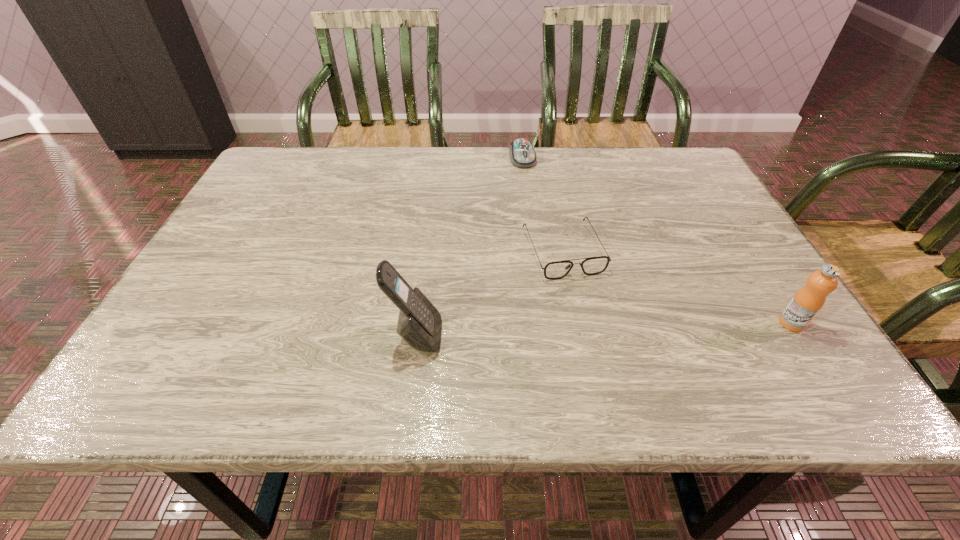
The height and width of the screenshot is (540, 960). Identify the location of vacant area at the near edge. (269, 341).

The height and width of the screenshot is (540, 960). In the image, there is a desktop. What are the coordinates of `vacant space at the left edge` in the screenshot? It's located at (256, 219).

In the image, there is a desktop. Where is `vacant area at the far left corner`? Image resolution: width=960 pixels, height=540 pixels. vacant area at the far left corner is located at coordinates (305, 192).

Locate an element on the screen. vacant space at the far right corner is located at coordinates (661, 156).

Where is `free space at the near right corner of the desktop`? This screenshot has height=540, width=960. free space at the near right corner of the desktop is located at coordinates (797, 334).

Identify the location of free point between the second tallest object and the sunglasses. (677, 287).

This screenshot has width=960, height=540. Find the location of `free space between the leftmost object and the rightmost object`. free space between the leftmost object and the rightmost object is located at coordinates (604, 329).

The height and width of the screenshot is (540, 960). Find the location of `unoccupied position between the rightmost object and the sunglasses`. unoccupied position between the rightmost object and the sunglasses is located at coordinates (677, 287).

The image size is (960, 540). Find the location of `empty space between the farthest object and the orange juice`. empty space between the farthest object and the orange juice is located at coordinates tap(657, 241).

The width and height of the screenshot is (960, 540). I want to click on vacant space that is in between the sunglasses and the shortest object, so click(542, 205).